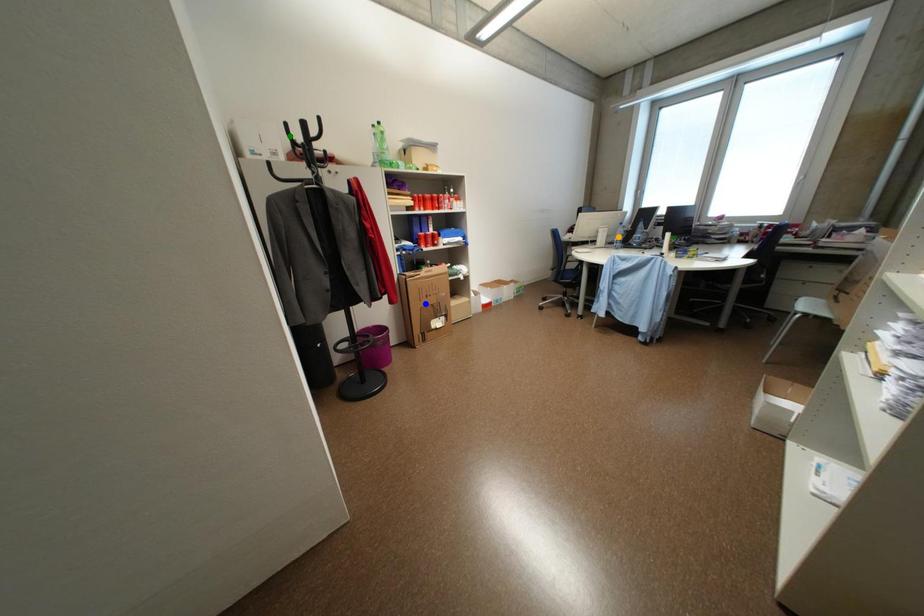
Order these from nearest to farthest:
green point
blue point
orange point

1. green point
2. blue point
3. orange point